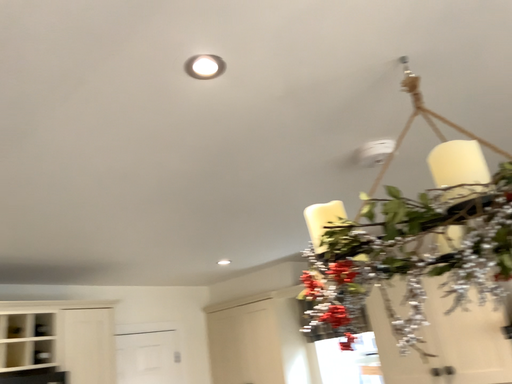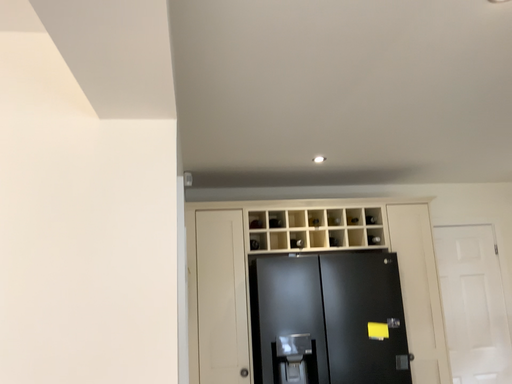
Question: How did the camera likely rotate when shooting the video?

Choices:
 (A) rotated right
 (B) rotated left

Answer: (B)